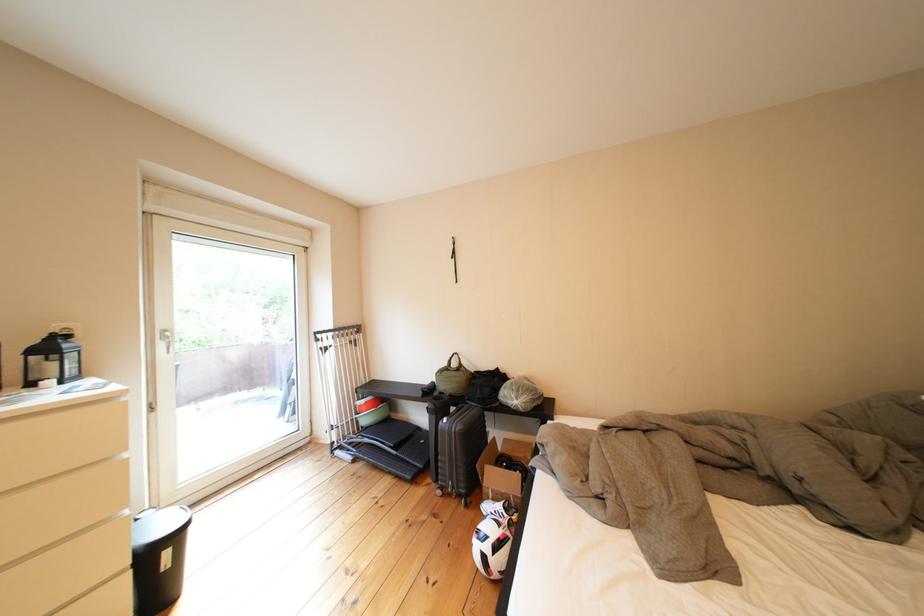
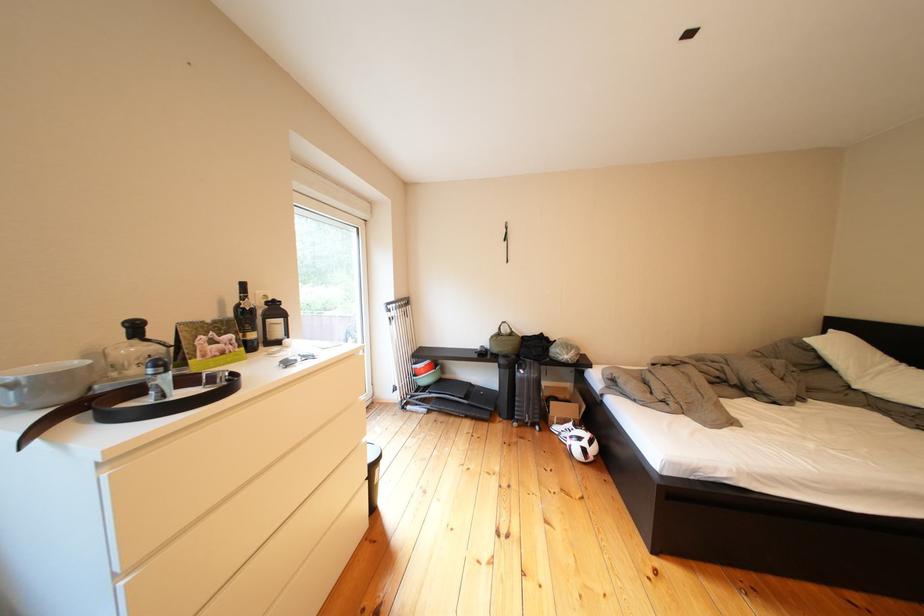
In the second image, find the point that corresponds to the point at 415,419 in the first image.

(462, 381)